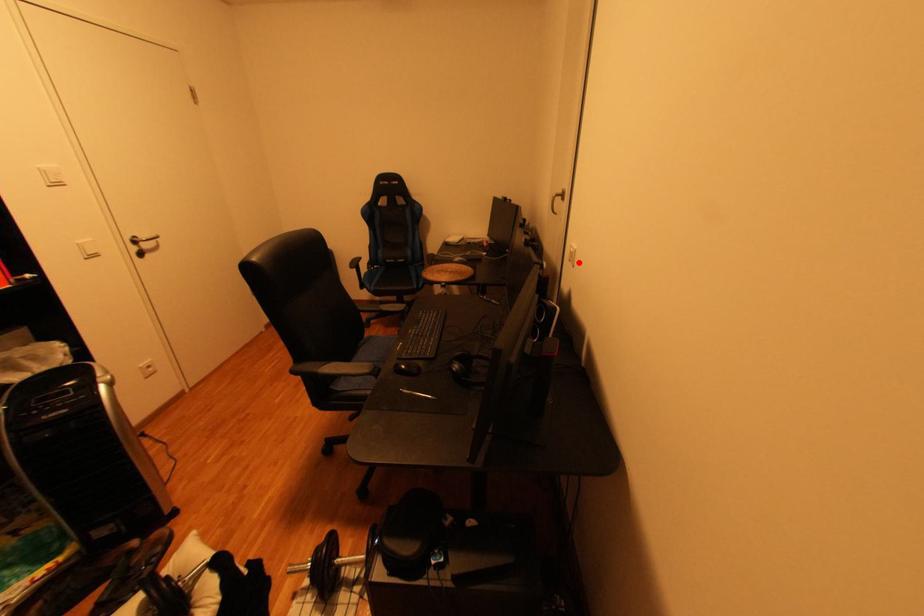
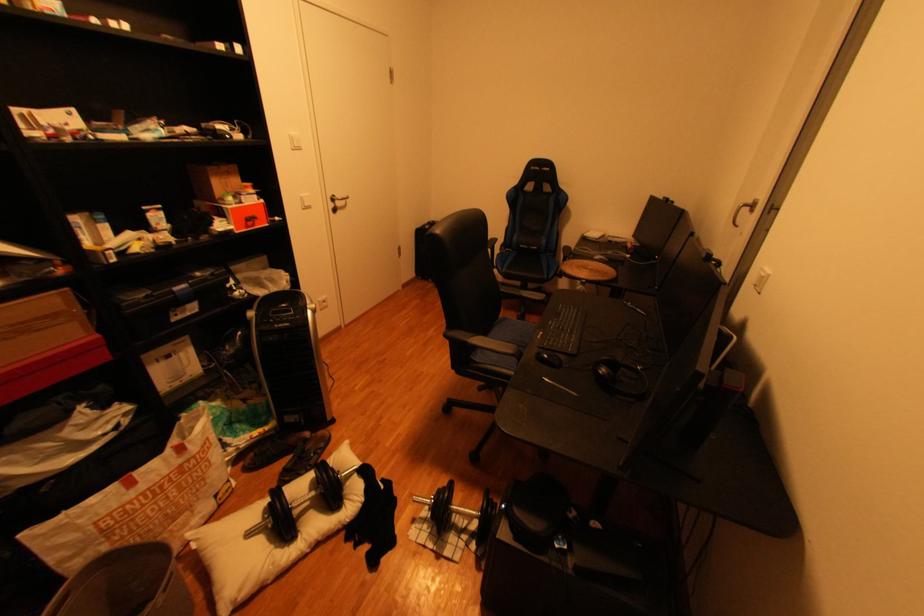
In the second image, find the point that corresponds to the highlighted location in the first image.

(763, 286)